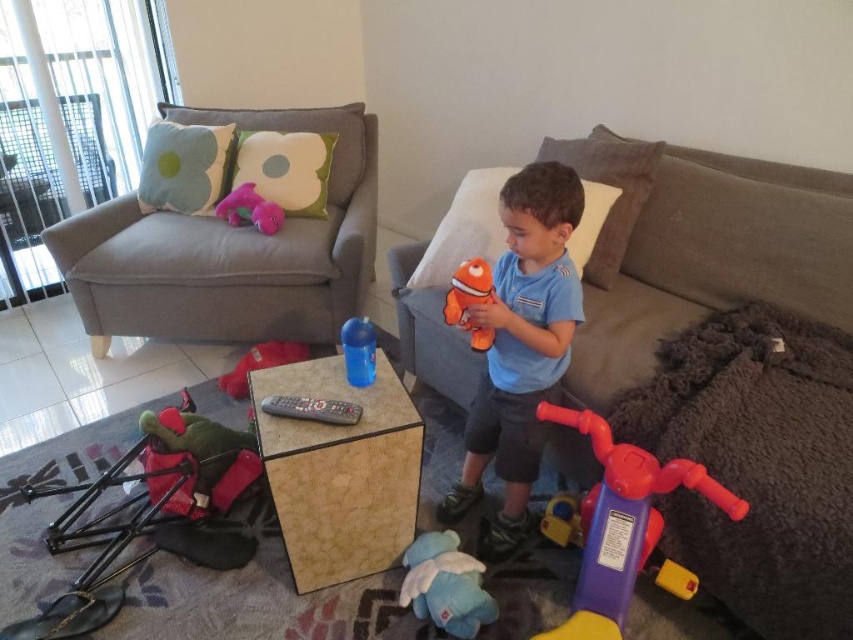
Question: Is rubberized purple and red tricycle at lower right positioned at the back of pink plush toy at upper left?

Choices:
 (A) no
 (B) yes

Answer: (A)

Question: Among these objects, which one is nearest to the camera?

Choices:
 (A) black plastic remote at center
 (B) light gray fabric couch at upper left

Answer: (A)

Question: Considering the real-world distances, which object is closest to the black plastic remote at center?

Choices:
 (A) rubberized plastic remote at center
 (B) pink plush toy at upper left
 (C) orange plush toy at center

Answer: (C)

Question: Can you confirm if light gray fabric couch at upper left is thinner than rubberized purple and red tricycle at lower right?

Choices:
 (A) no
 (B) yes

Answer: (A)

Question: Can you confirm if orange plush toy at center is bigger than black plastic remote at center?

Choices:
 (A) yes
 (B) no

Answer: (A)

Question: Which point is closer to the camera?

Choices:
 (A) orange plush toy at center
 (B) black plastic remote at center
 (C) pink plush toy at upper left
 (D) blue plush toy at lower center

Answer: (A)